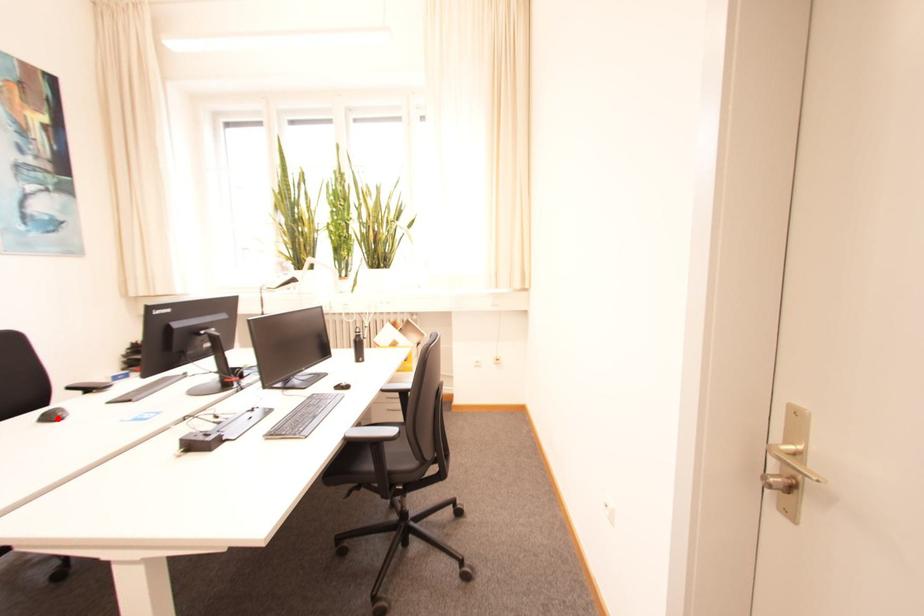
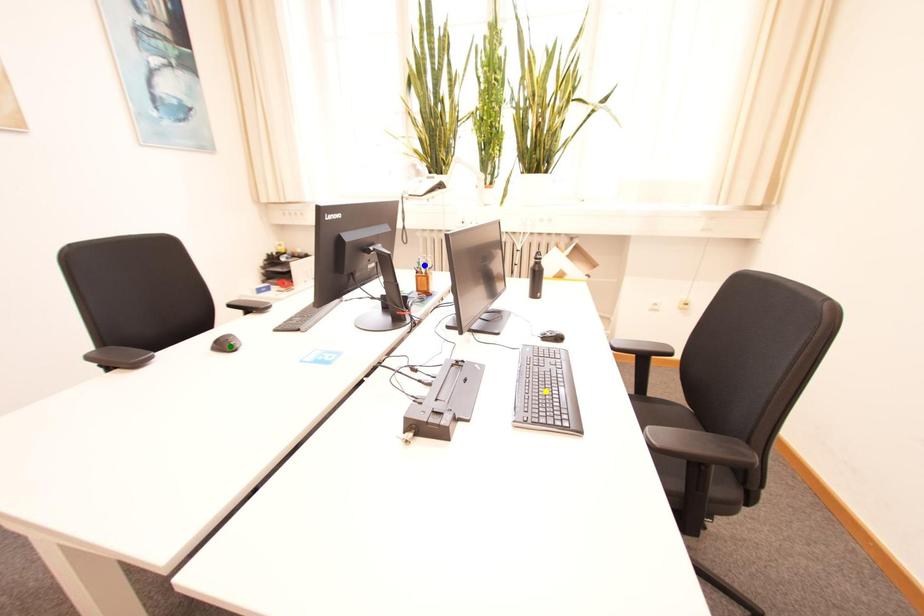
Question: I am providing you with two images of the same scene from different viewpoints. A red point is marked on the first image. You are given multiple points on the second image. Which point in image 2 is actually the same real-world point as the red point in image 1?

Choices:
 (A) yellow point
 (B) blue point
 (C) green point

Answer: (C)